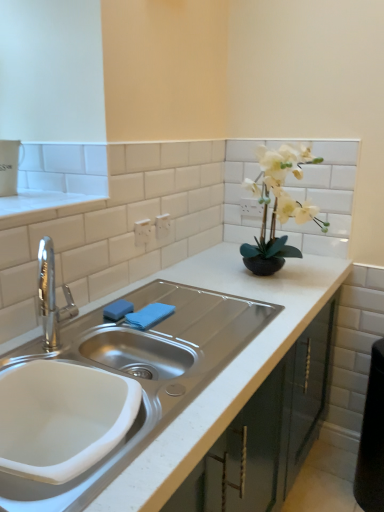
Question: Is white matte countertop at center bigger or smaller than blue sponge at sink?

Choices:
 (A) small
 (B) big

Answer: (B)

Question: Would you say white matte countertop at center is inside or outside blue sponge at sink?

Choices:
 (A) inside
 (B) outside

Answer: (B)

Question: Which object is the closest to the white matte vase at upper right?

Choices:
 (A) blue sponge at sink
 (B) blue fabric towel at sink
 (C) white matte countertop at center
 (D) white ceramic sink at lower left

Answer: (C)

Question: Based on their relative distances, which object is nearer to the white matte vase at upper right?

Choices:
 (A) blue sponge at sink
 (B) white ceramic sink at lower left
 (C) white matte countertop at center
 (D) blue fabric towel at sink

Answer: (C)